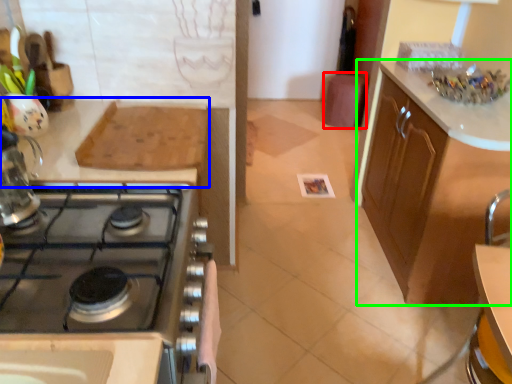
Question: Which object is the farthest from bar stool (highlighted by a red box)? Choose among these: countertop (highlighted by a blue box) or cabinetry (highlighted by a green box).

Choices:
 (A) countertop
 (B) cabinetry

Answer: (A)